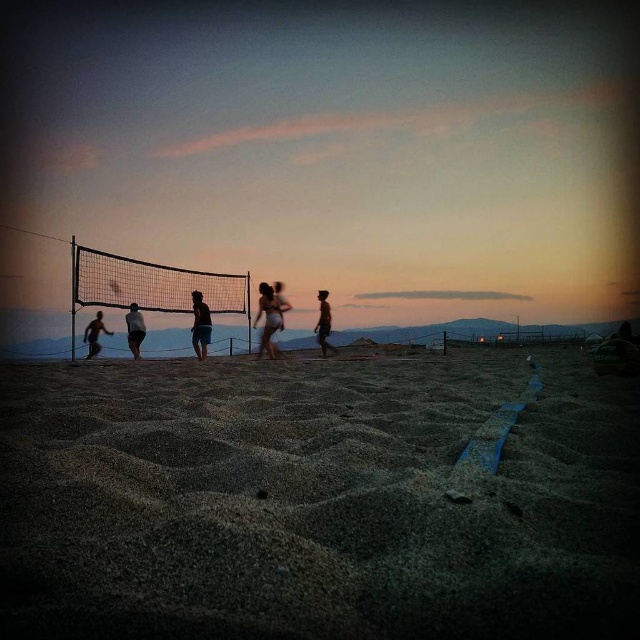
You are a photographer on the beach and want to capture a photo of the dark blue shorts at center and the silhouette sand volleyball player at center. Which object is positioned lower in the image?

The dark blue shorts at center is located below the silhouette sand volleyball player at center, so it is positioned lower in the image.

You are a photographer trying to capture the silhouette sand volleyball player at center without the dark blue shorts at center blocking the view. Is this possible based on their positions?

The dark blue shorts at center is in front of the silhouette sand volleyball player at center, so it would block the view. Move the camera angle to the side to avoid the obstruction.

You are a photographer standing at the edge of the beach. You want to take a photo of the silhouette figure at center and the smooth skin figure at center such that both are in focus. If your camera has a depth of field that can sharply focus objects within a 2 meter range, will both figures be in focus?

The silhouette figure at center and smooth skin figure at center are 2.16 meters apart. Since the distance between them exceeds the camera s 2 meter depth of field range, both figures cannot be in focus simultaneously.